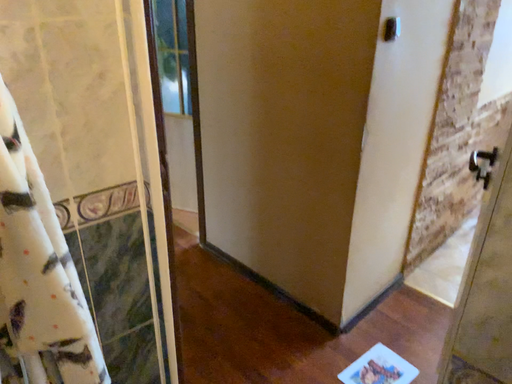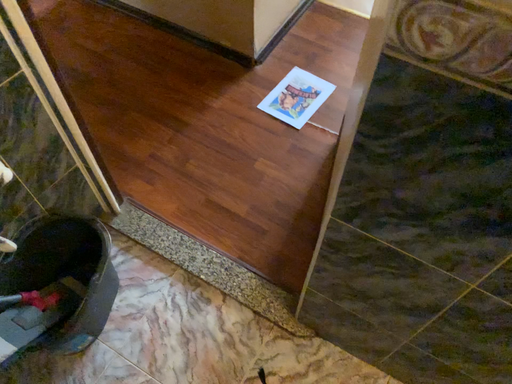
Question: Which way did the camera rotate in the video?

Choices:
 (A) rotated upward
 (B) rotated downward

Answer: (B)